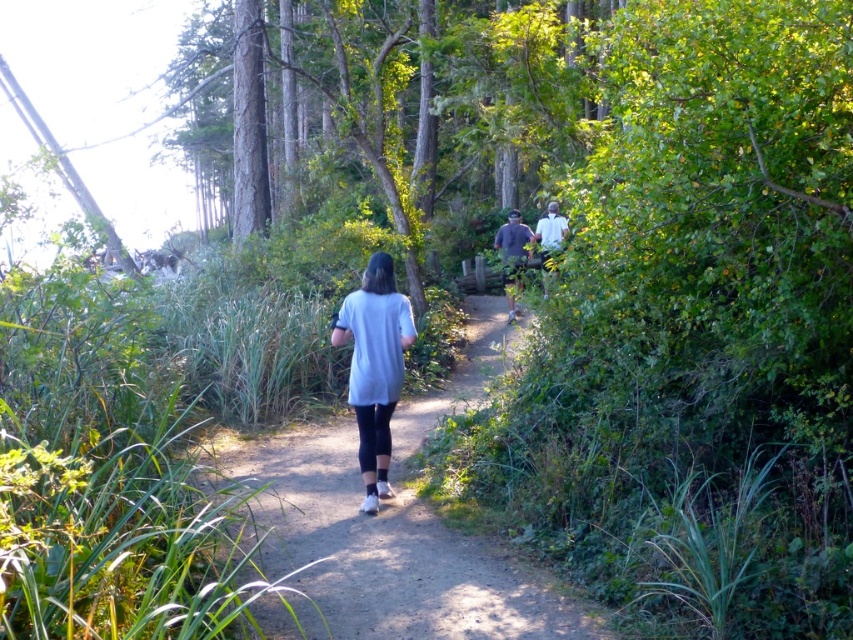
You are standing at the starting point of the forest trail and see two points marked on the path ahead of you. The first point is at coordinates point (505, 246) and the second point is at coordinates point (544, 218). If you walk towards the direction the person is facing, which point will you reach first?

Point (505, 246) is in front of point (544, 218), so you will reach point (505, 246) first when walking in the direction the person is facing.